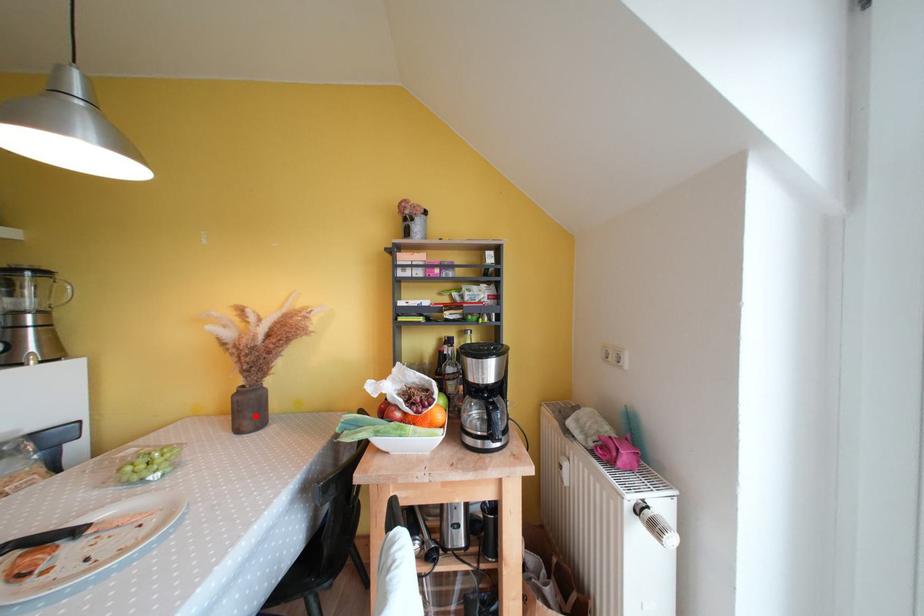
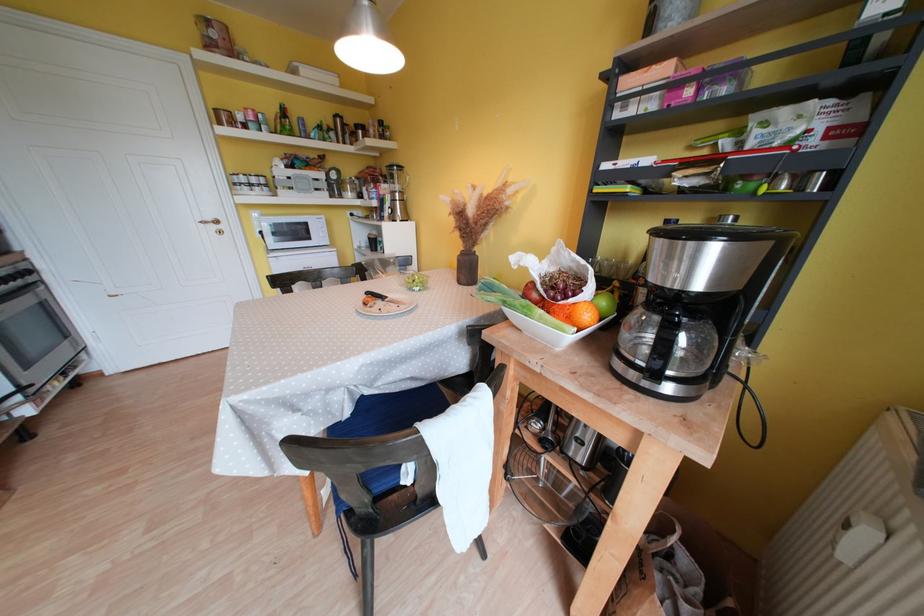
Where in the second image is the point corresponding to the highlighted location from the first image?

(472, 275)